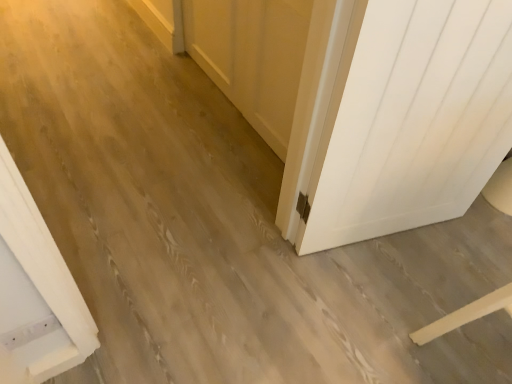
Question: Relative to white wood barn door at center, is white matte door at right in front or behind?

Choices:
 (A) behind
 (B) front

Answer: (B)

Question: Does point (412, 130) appear closer or farther from the camera than point (266, 100)?

Choices:
 (A) farther
 (B) closer

Answer: (B)

Question: In the image, is white matte door at right on the left side or the right side of white wood barn door at center?

Choices:
 (A) left
 (B) right

Answer: (B)

Question: Is point (218, 26) positioned closer to the camera than point (452, 142)?

Choices:
 (A) farther
 (B) closer

Answer: (A)

Question: Is white wood barn door at center inside or outside of white matte door at right?

Choices:
 (A) inside
 (B) outside

Answer: (B)

Question: From a real-world perspective, relative to white matte door at right, is white wood barn door at center vertically above or below?

Choices:
 (A) below
 (B) above

Answer: (A)

Question: Considering the positions of white wood barn door at center and white matte door at right in the image, is white wood barn door at center bigger or smaller than white matte door at right?

Choices:
 (A) big
 (B) small

Answer: (B)